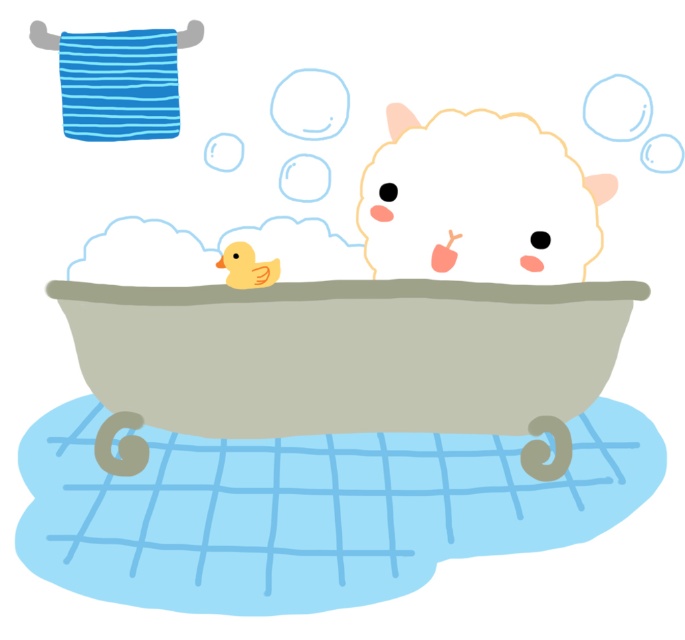
You are a toy boat floating in the bathtub. You want to reach the fluffy white animal at upper center to deliver a message. Which direction should you sail from the yellow rubber duck at center?

The fluffy white animal at upper center is to the right of the yellow rubber duck at center, so you should sail to the right from the yellow rubber duck at center to reach it.

You are a small toy boat that is 10 cm long. You want to sail from the edge of the matte gray bathtub at center to the yellow rubber duck at center. Is there enough space for you to move freely between them?

The matte gray bathtub at center might be wider than yellow rubber duck at center, but since the exact width isn t specified, it s uncertain if the boat can move freely. Check the actual distance before proceeding.